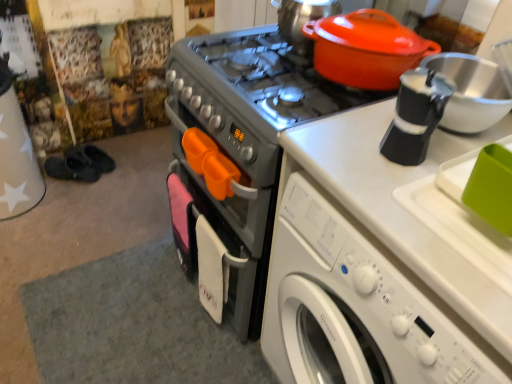
Where is `free point above metallic gray stove at center (from a real-world perspective)`? Image resolution: width=512 pixels, height=384 pixels. free point above metallic gray stove at center (from a real-world perspective) is located at coordinates (270, 72).